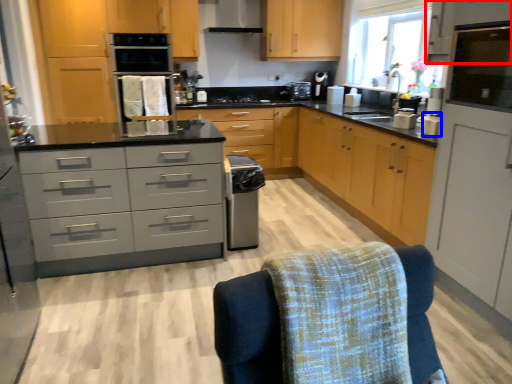
Question: Which object appears closest to the camera in this image, cabinetry (highlighted by a red box) or appliance (highlighted by a blue box)?

Choices:
 (A) cabinetry
 (B) appliance

Answer: (A)